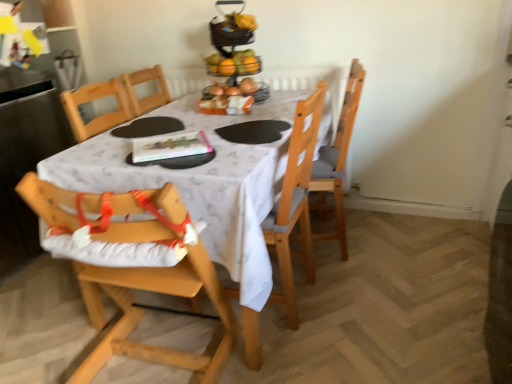
Find the location of a particular element. The height and width of the screenshot is (384, 512). free spot in front of wooden chair at center, acting as the second chair starting from the right is located at coordinates (304, 356).